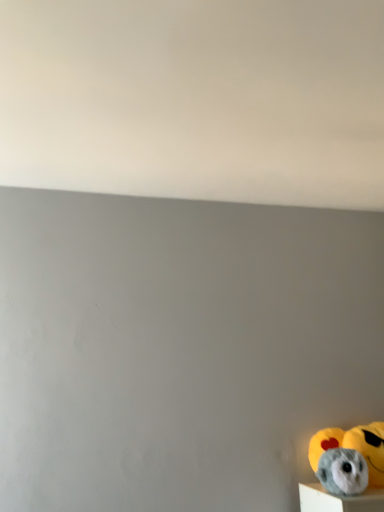
Measure the distance between point (351, 473) and camera.

Point (351, 473) is 1.45 meters away from camera.

What do you see at coordinates (349, 458) in the screenshot? I see `fluffy gray plush toy at lower right` at bounding box center [349, 458].

Where is `fluffy gray plush toy at lower right`? The width and height of the screenshot is (384, 512). fluffy gray plush toy at lower right is located at coordinates (349, 458).

What is the approximate width of fluffy gray plush toy at lower right?

It is 11.89 centimeters.

This screenshot has height=512, width=384. What do you see at coordinates (369, 448) in the screenshot?
I see `fluffy gray plush toy at lower right` at bounding box center [369, 448].

The width and height of the screenshot is (384, 512). Identify the location of fluffy gray plush toy at lower right. (369, 448).

The width and height of the screenshot is (384, 512). Find the location of `fluffy gray plush toy at lower right`. fluffy gray plush toy at lower right is located at coordinates (349, 458).

Is fluffy gray plush toy at lower right to the left of fluffy gray plush toy at lower right from the viewer's perspective?

Incorrect, fluffy gray plush toy at lower right is not on the left side of fluffy gray plush toy at lower right.

Does fluffy gray plush toy at lower right lie in front of fluffy gray plush toy at lower right?

No, fluffy gray plush toy at lower right is further to the viewer.

Is point (379, 442) in front of point (373, 457)?

No, it is not.

From the image's perspective, is fluffy gray plush toy at lower right positioned above or below fluffy gray plush toy at lower right?

fluffy gray plush toy at lower right is situated lower than fluffy gray plush toy at lower right in the image.

From a real-world perspective, does fluffy gray plush toy at lower right stand above fluffy gray plush toy at lower right?

Yes, from a real-world perspective, fluffy gray plush toy at lower right is on top of fluffy gray plush toy at lower right.

In the scene shown: Looking at their sizes, would you say fluffy gray plush toy at lower right is wider or thinner than fluffy gray plush toy at lower right?

In the image, fluffy gray plush toy at lower right appears to be more narrow than fluffy gray plush toy at lower right.

Who is shorter, fluffy gray plush toy at lower right or fluffy gray plush toy at lower right?

Standing shorter between the two is fluffy gray plush toy at lower right.

Is fluffy gray plush toy at lower right bigger than fluffy gray plush toy at lower right?

Yes, fluffy gray plush toy at lower right is bigger than fluffy gray plush toy at lower right.

Is fluffy gray plush toy at lower right spatially inside fluffy gray plush toy at lower right, or outside of it?

fluffy gray plush toy at lower right is spatially situated outside fluffy gray plush toy at lower right.

Is fluffy gray plush toy at lower right not close to fluffy gray plush toy at lower right?

No, there isn't a large distance between fluffy gray plush toy at lower right and fluffy gray plush toy at lower right.

Is fluffy gray plush toy at lower right oriented away from fluffy gray plush toy at lower right?

No, fluffy gray plush toy at lower right's orientation is not away from fluffy gray plush toy at lower right.

What are the coordinates of `toy that is in front of the fluffy gray plush toy at lower right` in the screenshot? It's located at (349, 458).

Is fluffy gray plush toy at lower right to the right of fluffy gray plush toy at lower right from the viewer's perspective?

No.

From the picture: Does fluffy gray plush toy at lower right lie in front of fluffy gray plush toy at lower right?

That is True.

Does point (338, 490) lie in front of point (373, 422)?

Yes, it is.

From the image's perspective, does fluffy gray plush toy at lower right appear lower than fluffy gray plush toy at lower right?

No, from the image's perspective, fluffy gray plush toy at lower right is not below fluffy gray plush toy at lower right.

From a real-world perspective, is fluffy gray plush toy at lower right located higher than fluffy gray plush toy at lower right?

No, from a real-world perspective, fluffy gray plush toy at lower right is not on top of fluffy gray plush toy at lower right.

Between fluffy gray plush toy at lower right and fluffy gray plush toy at lower right, which one has smaller width?

With smaller width is fluffy gray plush toy at lower right.

Between fluffy gray plush toy at lower right and fluffy gray plush toy at lower right, which one has less height?

With less height is fluffy gray plush toy at lower right.

Between fluffy gray plush toy at lower right and fluffy gray plush toy at lower right, which one has smaller size?

With smaller size is fluffy gray plush toy at lower right.

Could fluffy gray plush toy at lower right be considered to be inside fluffy gray plush toy at lower right?

No, fluffy gray plush toy at lower right is not a part of fluffy gray plush toy at lower right.

Based on the photo, is fluffy gray plush toy at lower right not close to fluffy gray plush toy at lower right?

That's not correct — fluffy gray plush toy at lower right is a little close to fluffy gray plush toy at lower right.

Is fluffy gray plush toy at lower right positioned with its back to fluffy gray plush toy at lower right?

fluffy gray plush toy at lower right does not have its back to fluffy gray plush toy at lower right.

How different are the orientations of fluffy gray plush toy at lower right and fluffy gray plush toy at lower right in degrees?

The angular difference between fluffy gray plush toy at lower right and fluffy gray plush toy at lower right is 1.81 degrees.

Measure the distance from fluffy gray plush toy at lower right to fluffy gray plush toy at lower right.

fluffy gray plush toy at lower right and fluffy gray plush toy at lower right are 1.68 inches apart.

Locate an element on the screen. This screenshot has width=384, height=512. toy lying in front of the fluffy gray plush toy at lower right is located at coordinates (349, 458).

The width and height of the screenshot is (384, 512). What are the coordinates of `toy above the fluffy gray plush toy at lower right (from the image's perspective)` in the screenshot? It's located at (349, 458).

What are the coordinates of `stuffed animal above the fluffy gray plush toy at lower right (from a real-world perspective)` in the screenshot? It's located at (369, 448).